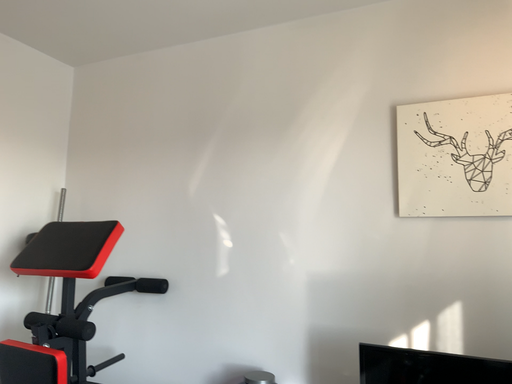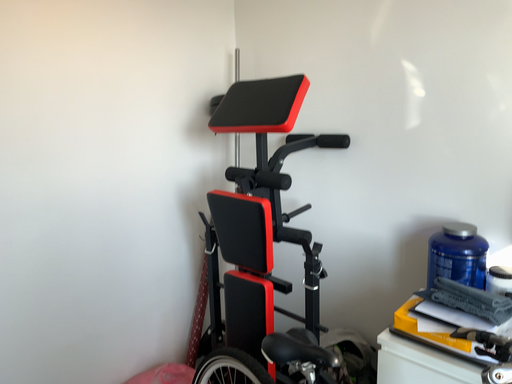
Question: How did the camera likely rotate when shooting the video?

Choices:
 (A) rotated right
 (B) rotated left

Answer: (B)